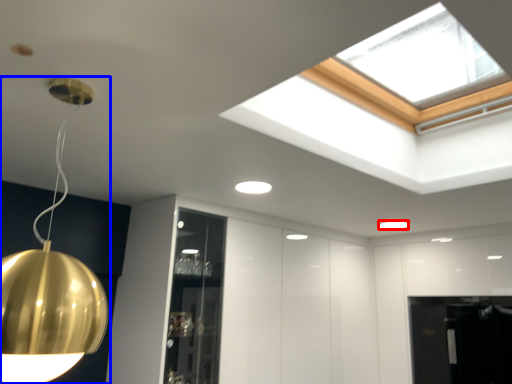
Question: Which object is closer to the camera taking this photo, lamp (highlighted by a red box) or lamp (highlighted by a blue box)?

Choices:
 (A) lamp
 (B) lamp

Answer: (B)